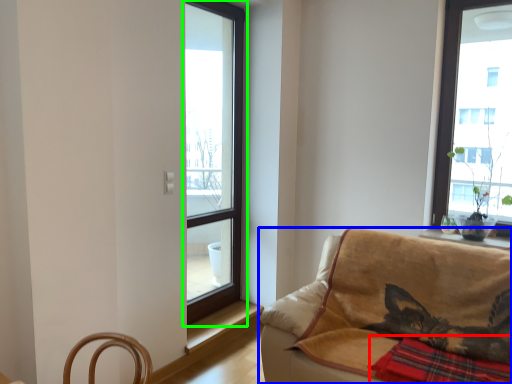
Question: Which is farther away from plaid (highlighted by a red box)? studio couch (highlighted by a blue box) or window (highlighted by a green box)?

Choices:
 (A) studio couch
 (B) window

Answer: (B)